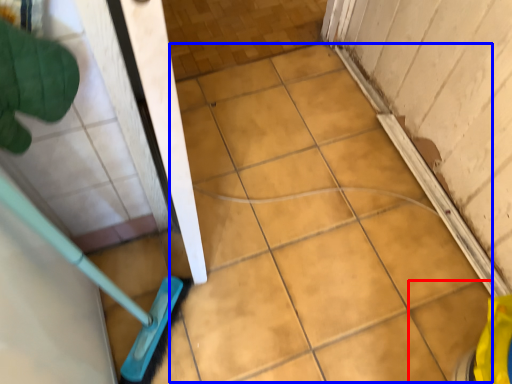
Question: Which point is further to the camera, ceramic tile (highlighted by a red box) or ceramic tile (highlighted by a blue box)?

Choices:
 (A) ceramic tile
 (B) ceramic tile

Answer: (B)